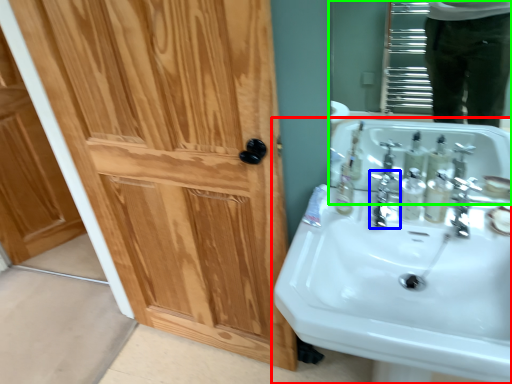
Question: Which object is positioned closest to sink (highlighted by a red box)? Select from plumbing fixture (highlighted by a blue box) and mirror (highlighted by a green box).

Choices:
 (A) plumbing fixture
 (B) mirror

Answer: (A)